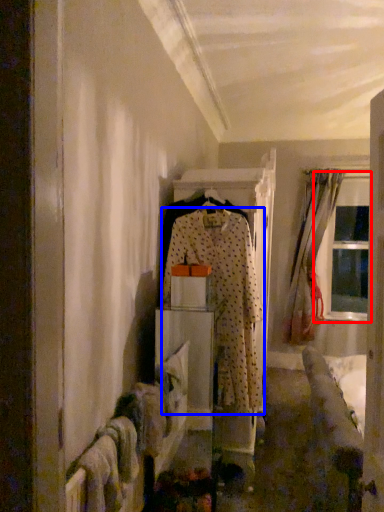
Question: Which of the following is the closest to the observer, window (highlighted by a red box) or fancy dress (highlighted by a blue box)?

Choices:
 (A) window
 (B) fancy dress

Answer: (B)